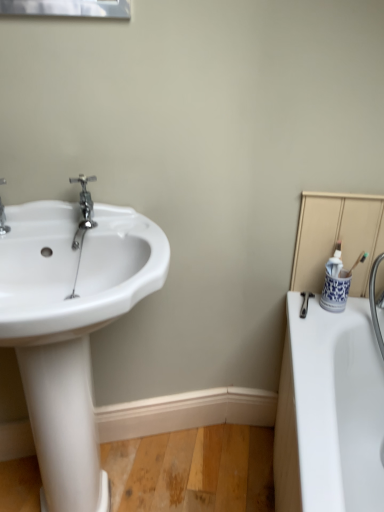
Question: Can you confirm if blue and white ceramic cup at right is positioned to the left of white glossy sink at left?

Choices:
 (A) yes
 (B) no

Answer: (B)

Question: Does blue and white ceramic cup at right appear on the right side of white glossy sink at left?

Choices:
 (A) no
 (B) yes

Answer: (B)

Question: Is blue and white ceramic cup at right oriented towards white glossy sink at left?

Choices:
 (A) yes
 (B) no

Answer: (B)

Question: From a real-world perspective, is blue and white ceramic cup at right on white glossy sink at left?

Choices:
 (A) yes
 (B) no

Answer: (A)

Question: Are blue and white ceramic cup at right and white glossy sink at left beside each other?

Choices:
 (A) no
 (B) yes

Answer: (A)

Question: Considering their positions, is white glossy sink at left located in front of or behind polished chrome faucet at left?

Choices:
 (A) behind
 (B) front

Answer: (B)

Question: In terms of height, does white glossy sink at left look taller or shorter compared to polished chrome faucet at left?

Choices:
 (A) tall
 (B) short

Answer: (A)

Question: Is white glossy sink at left situated inside polished chrome faucet at left or outside?

Choices:
 (A) outside
 (B) inside

Answer: (A)

Question: Is point (29, 397) positioned closer to the camera than point (84, 189)?

Choices:
 (A) farther
 (B) closer

Answer: (B)

Question: Which is correct: blue and white ceramic cup at right is inside white glossy sink at left, or outside of it?

Choices:
 (A) outside
 (B) inside

Answer: (A)

Question: Visually, is blue and white ceramic cup at right positioned to the left or to the right of white glossy sink at left?

Choices:
 (A) right
 (B) left

Answer: (A)

Question: Does point (332, 287) appear closer or farther from the camera than point (127, 278)?

Choices:
 (A) farther
 (B) closer

Answer: (A)

Question: Is blue and white ceramic cup at right in front of or behind white glossy sink at left in the image?

Choices:
 (A) front
 (B) behind

Answer: (B)

Question: Considering the positions of polished chrome faucet at left and blue and white ceramic cup at right in the image, is polished chrome faucet at left wider or thinner than blue and white ceramic cup at right?

Choices:
 (A) thin
 (B) wide

Answer: (B)

Question: From a real-world perspective, is polished chrome faucet at left positioned above or below blue and white ceramic cup at right?

Choices:
 (A) below
 (B) above

Answer: (B)